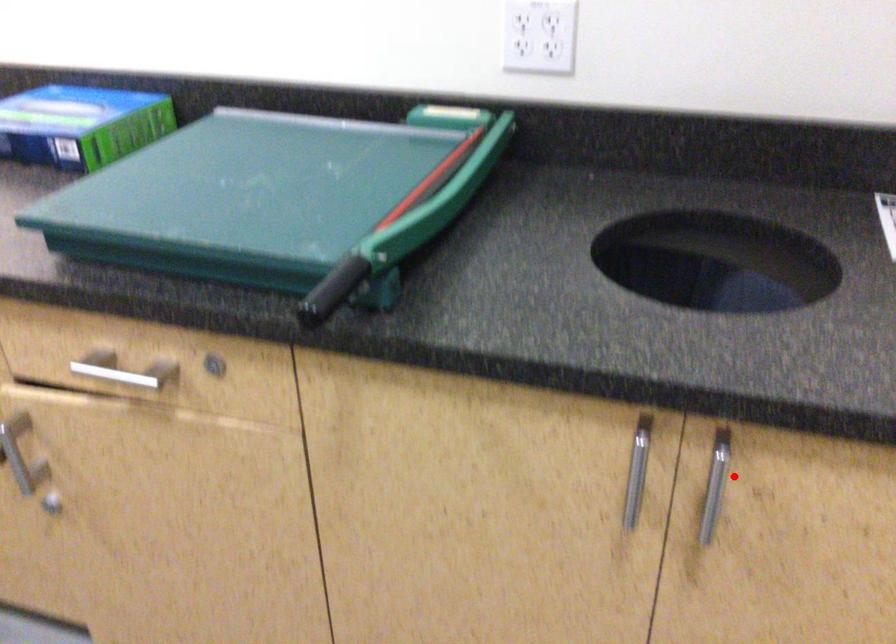
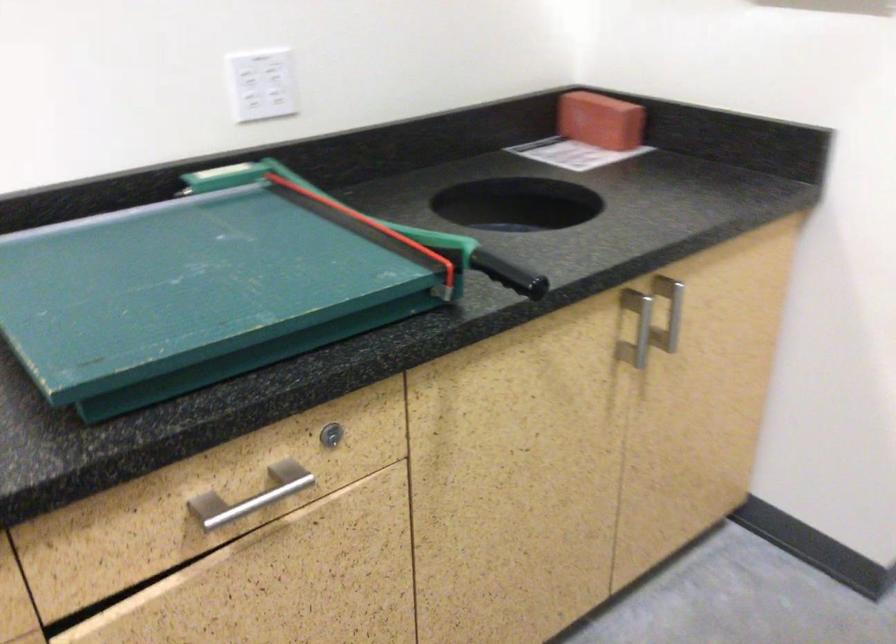
In the second image, find the point that corresponds to the highlighted location in the first image.

(669, 307)